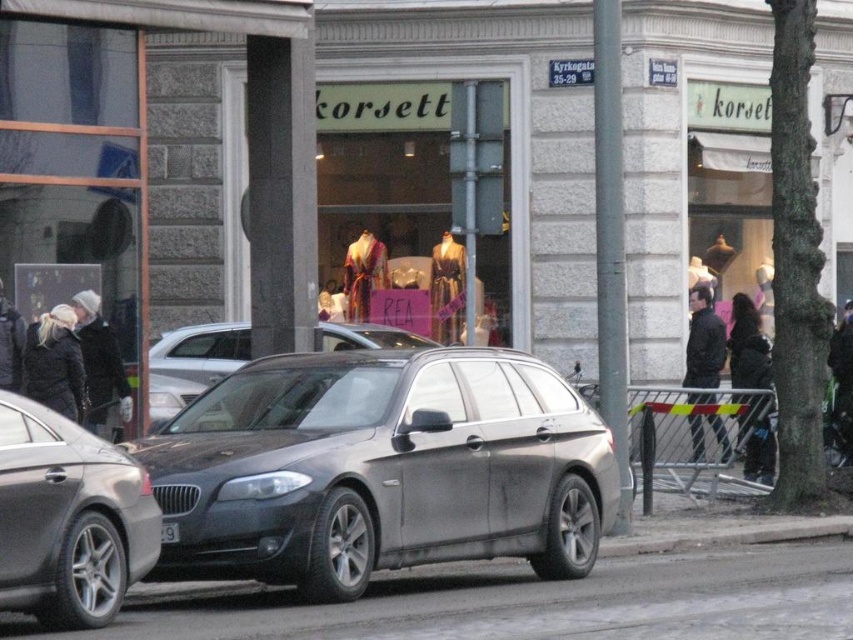
Question: Which object is the closest to the dark gray metallic car at center?

Choices:
 (A) clear glass window at upper left
 (B) satin silver car at center
 (C) black plastic license plate at center
 (D) matte glass shop window at center

Answer: (C)

Question: Which object appears farthest from the camera in this image?

Choices:
 (A) matte glass shop window at center
 (B) black plastic license plate at center
 (C) satin silver wagon at center

Answer: (A)

Question: Does satin silver wagon at center have a lesser width compared to satin silver car at center?

Choices:
 (A) yes
 (B) no

Answer: (B)

Question: Estimate the real-world distances between objects in this image. Which object is closer to the matte glass shop window at center?

Choices:
 (A) dark gray metallic car at center
 (B) satin silver wagon at center
 (C) black plastic license plate at center

Answer: (B)

Question: Can you confirm if clear glass window at upper left is positioned to the right of satin silver car at center?

Choices:
 (A) no
 (B) yes

Answer: (A)

Question: Is satin silver wagon at center bigger than satin silver car at center?

Choices:
 (A) yes
 (B) no

Answer: (A)